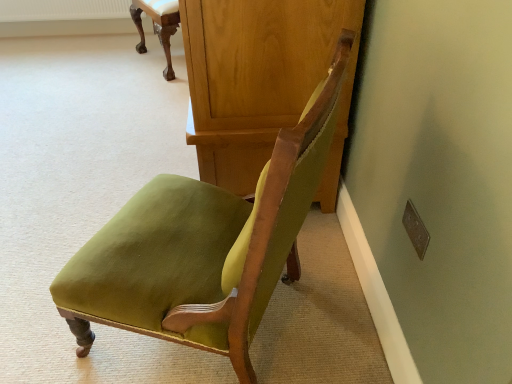
Find the location of `free location to the left of wooden dresser at center`. free location to the left of wooden dresser at center is located at coordinates (102, 126).